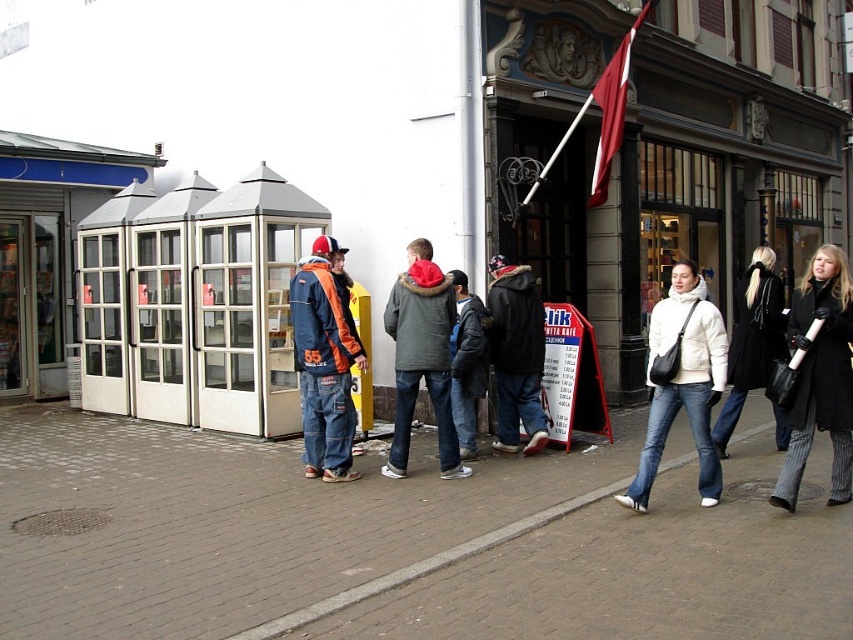
You are a photographer planning to take a photo of the two jackets, denim jacket at center and dark gray jacket at center, from a low angle to emphasize their height. Which jacket will appear taller in the photo?

The denim jacket at center will appear taller in the photo because it is taller than the dark gray jacket at center.

You are standing at the point with coordinates point (682, 384) in the image. What object are you currently standing on?

You are standing on the white matte jacket at lower right.

You are a photographer standing on the sidewalk. You want to take a picture of the gray fleece jacket at center and the black leather coat at right. Which object is closer to the camera?

The gray fleece jacket at center is closer to the camera because it is positioned under the black leather coat at right, indicating it is in front.